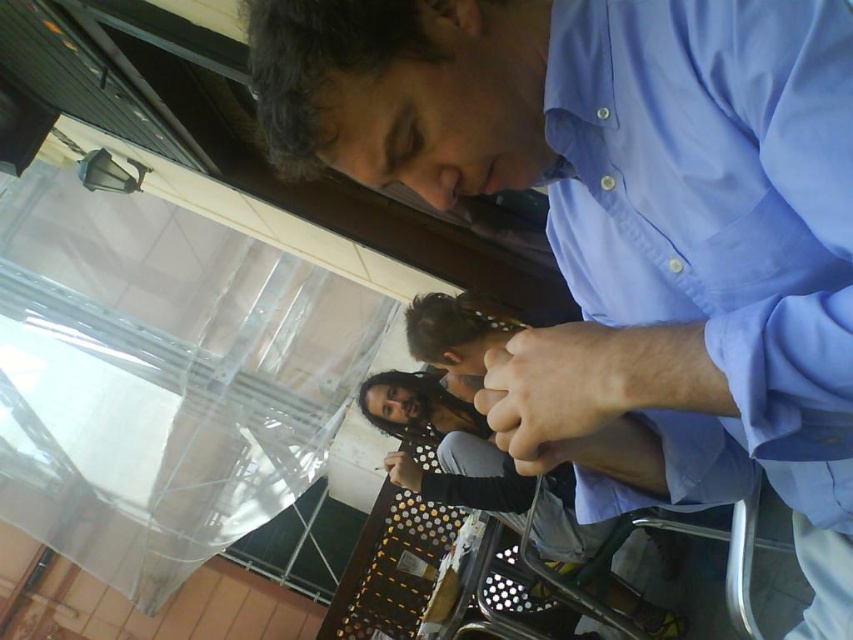
Can you confirm if light blue cotton shirt at center is shorter than smooth skin hand at center?

No.

The image size is (853, 640). Describe the element at coordinates (715, 227) in the screenshot. I see `light blue cotton shirt at center` at that location.

Locate an element on the screen. This screenshot has height=640, width=853. light blue cotton shirt at center is located at coordinates tap(715, 227).

Is point (820, 147) positioned behind point (598, 477)?

No, it is not.

Where is `blue cotton shirt at upper right`? The image size is (853, 640). blue cotton shirt at upper right is located at coordinates point(625,225).

Consider the image. Does blue cotton shirt at upper right appear on the left side of smooth skin hand at center?

No, blue cotton shirt at upper right is not to the left of smooth skin hand at center.

From the picture: Which is more to the right, blue cotton shirt at upper right or smooth skin hand at center?

Positioned to the right is blue cotton shirt at upper right.

What are the coordinates of `blue cotton shirt at upper right` in the screenshot? It's located at (625, 225).

Locate an element on the screen. blue cotton shirt at upper right is located at coordinates [x=625, y=225].